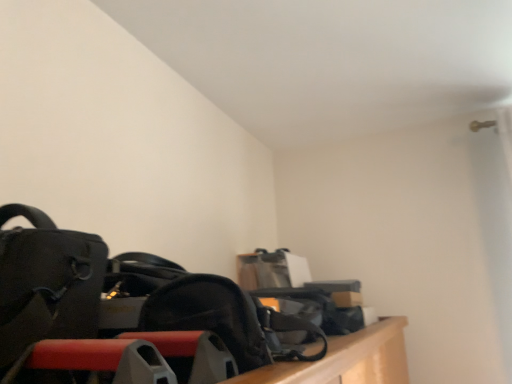
Describe the element at coordinates (209, 315) in the screenshot. I see `black matte shoulder bag at center` at that location.

In order to click on black matte shoulder bag at center in this screenshot , I will do click(209, 315).

Describe the element at coordinates (46, 283) in the screenshot. This screenshot has height=384, width=512. I see `matte black bag at left` at that location.

Find the location of a particular element. matte black bag at left is located at coordinates (46, 283).

You are a GUI agent. You are given a task and a screenshot of the screen. Output one action in this format:
    pyautogui.click(x=<x>, y=<y>)
    Task: Click on the black matte shoulder bag at center
    The width and height of the screenshot is (512, 384).
    Given the screenshot: What is the action you would take?
    pyautogui.click(x=209, y=315)

In the scene shown: Does black matte shoulder bag at center appear on the left side of matte black bag at left?

No.

Does black matte shoulder bag at center lie in front of matte black bag at left?

No, black matte shoulder bag at center is further to the viewer.

Considering the positions of point (143, 308) and point (32, 325), is point (143, 308) closer or farther from the camera than point (32, 325)?

Point (143, 308).

From the image's perspective, between black matte shoulder bag at center and matte black bag at left, who is located below?

From the image's view, black matte shoulder bag at center is below.

From a real-world perspective, is black matte shoulder bag at center positioned over matte black bag at left based on gravity?

Actually, black matte shoulder bag at center is physically below matte black bag at left in the real world.

Is black matte shoulder bag at center thinner than matte black bag at left?

Yes.

Which of these two, black matte shoulder bag at center or matte black bag at left, stands taller?

With more height is matte black bag at left.

Considering the relative sizes of black matte shoulder bag at center and matte black bag at left in the image provided, is black matte shoulder bag at center bigger than matte black bag at left?

No, black matte shoulder bag at center is not bigger than matte black bag at left.

Could matte black bag at left be considered to be inside black matte shoulder bag at center?

That's incorrect, matte black bag at left is not inside black matte shoulder bag at center.

Is black matte shoulder bag at center placed right next to matte black bag at left?

black matte shoulder bag at center is not next to matte black bag at left, and they're not touching.

Is black matte shoulder bag at center facing towards matte black bag at left?

No, black matte shoulder bag at center is not turned towards matte black bag at left.

Find the location of a particular element. luggage and bags located in front of the black matte shoulder bag at center is located at coordinates (46, 283).

From the picture: Which object is positioned more to the left, matte black bag at left or black matte shoulder bag at center?

matte black bag at left is more to the left.

Relative to black matte shoulder bag at center, is matte black bag at left in front or behind?

Clearly, matte black bag at left is in front of black matte shoulder bag at center.

Is point (77, 284) closer or farther from the camera than point (189, 323)?

Point (77, 284) is closer to the camera than point (189, 323).

From the image's perspective, does matte black bag at left appear lower than black matte shoulder bag at center?

Incorrect, from the image's perspective, matte black bag at left is higher than black matte shoulder bag at center.

From a real-world perspective, is matte black bag at left physically located above or below black matte shoulder bag at center?

matte black bag at left is situated higher than black matte shoulder bag at center in the real world.

Considering the relative sizes of matte black bag at left and black matte shoulder bag at center in the image provided, is matte black bag at left thinner than black matte shoulder bag at center?

No.

Can you confirm if matte black bag at left is shorter than black matte shoulder bag at center?

Incorrect, the height of matte black bag at left does not fall short of that of black matte shoulder bag at center.

Consider the image. Can you confirm if matte black bag at left is bigger than black matte shoulder bag at center?

Correct, matte black bag at left is larger in size than black matte shoulder bag at center.

Which is correct: matte black bag at left is inside black matte shoulder bag at center, or outside of it?

matte black bag at left exists outside the volume of black matte shoulder bag at center.

Is matte black bag at left not close to black matte shoulder bag at center?

No, matte black bag at left is in close proximity to black matte shoulder bag at center.

Is matte black bag at left oriented towards black matte shoulder bag at center?

No, matte black bag at left is not facing towards black matte shoulder bag at center.

The height and width of the screenshot is (384, 512). Identify the location of luggage and bags above the black matte shoulder bag at center (from a real-world perspective). (46, 283).

Locate an element on the screen. luggage and bags lying on the left of black matte shoulder bag at center is located at coordinates (46, 283).

The height and width of the screenshot is (384, 512). What are the coordinates of `shoulder bag located below the matte black bag at left (from the image's perspective)` in the screenshot? It's located at (209, 315).